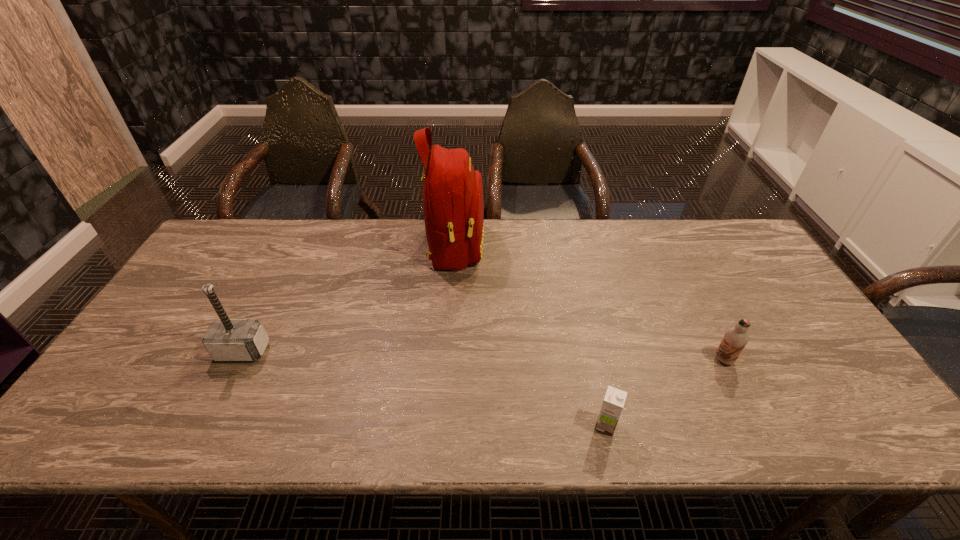
In the image, there is a desktop. Identify the location of vacant space at the near right corner. (852, 414).

At what (x,y) coordinates should I click in order to perform the action: click on free point between the third shortest object and the second object from left to right. Please return your answer as a coordinate pair (x, y). Looking at the image, I should click on (348, 299).

Image resolution: width=960 pixels, height=540 pixels. What are the coordinates of `empty space between the left chocolate milk and the second object from left to right` in the screenshot? It's located at (530, 336).

Identify the location of free space that is in between the left chocolate milk and the hammer. [424, 388].

Where is `free spot between the farthest object and the left chocolate milk`? This screenshot has width=960, height=540. free spot between the farthest object and the left chocolate milk is located at coordinates (530, 336).

Find the location of `vacant space that's between the leftmost object and the second object from right to left`. vacant space that's between the leftmost object and the second object from right to left is located at coordinates (424, 388).

Locate an element on the screen. The width and height of the screenshot is (960, 540). vacant space that is in between the shortest object and the farthest object is located at coordinates (530, 336).

Where is `blank region between the nearer chocolate milk and the rightmost object`? The width and height of the screenshot is (960, 540). blank region between the nearer chocolate milk and the rightmost object is located at coordinates (664, 393).

I want to click on vacant region between the farther chocolate milk and the shortest object, so click(664, 393).

Where is `empty space that is in between the farther chocolate milk and the shortest object`? This screenshot has height=540, width=960. empty space that is in between the farther chocolate milk and the shortest object is located at coordinates (664, 393).